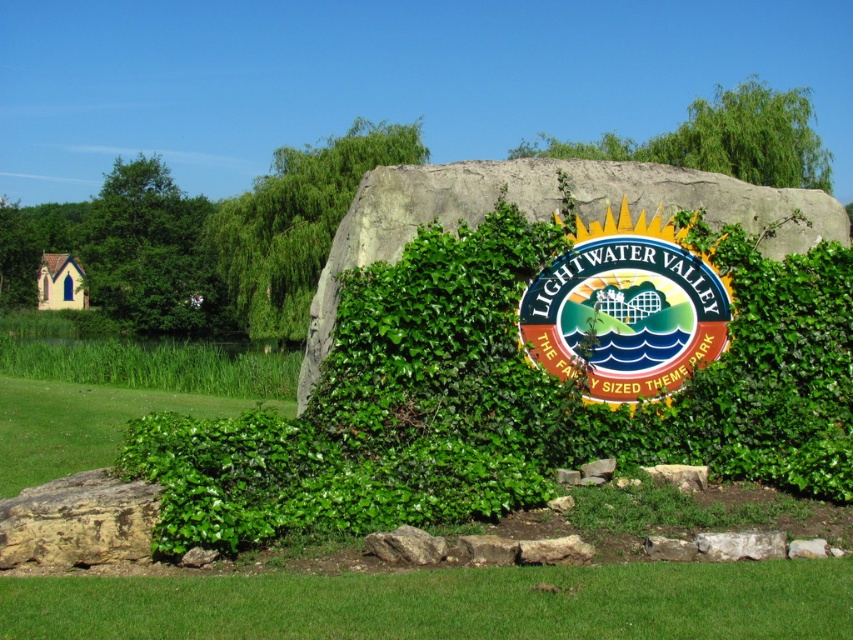
You are standing at the entrance of Lightwater Valley Theme Park and want to locate the metallic gold sign at center. According to the map coordinates, where would you find it?

The metallic gold sign at center is located at the coordinates point [625,308].

You are standing at the entrance of Lightwater Valley Theme Park and want to take a photo of the metallic gold sign at center. If your camera has a minimum focusing distance of 10 meters, will you be able to take a clear photo without moving closer?

The metallic gold sign at center is 9.25 meters away from the viewer. Since the minimum focusing distance of the camera is 10 meters, the viewer is too close to the sign to take a clear photo without moving back further.

You are standing at the entrance of Lightwater Valley Theme Park and want to take a photo of the sign. The sign has a circular design with the park name at the top and the slogan below. There is a point marked at coordinates point (506, 620). If you need to adjust your position to be exactly 6 meters away from this point to get the perfect shot, should you move closer or farther away?

The point (506, 620) is currently 5.90 meters from the camera. Since 5.90 meters is less than 6 meters, you should move slightly farther away to reach the desired distance of 6 meters.